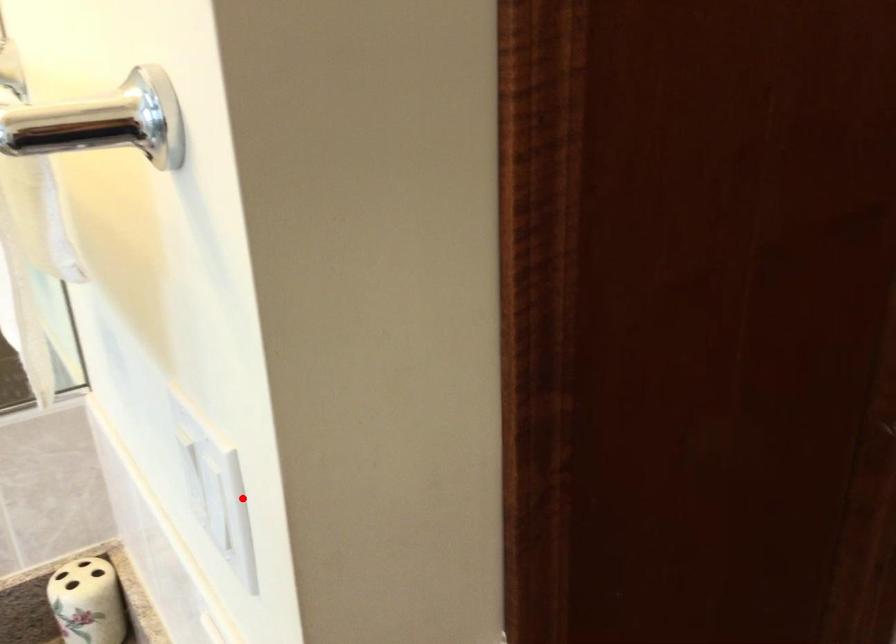
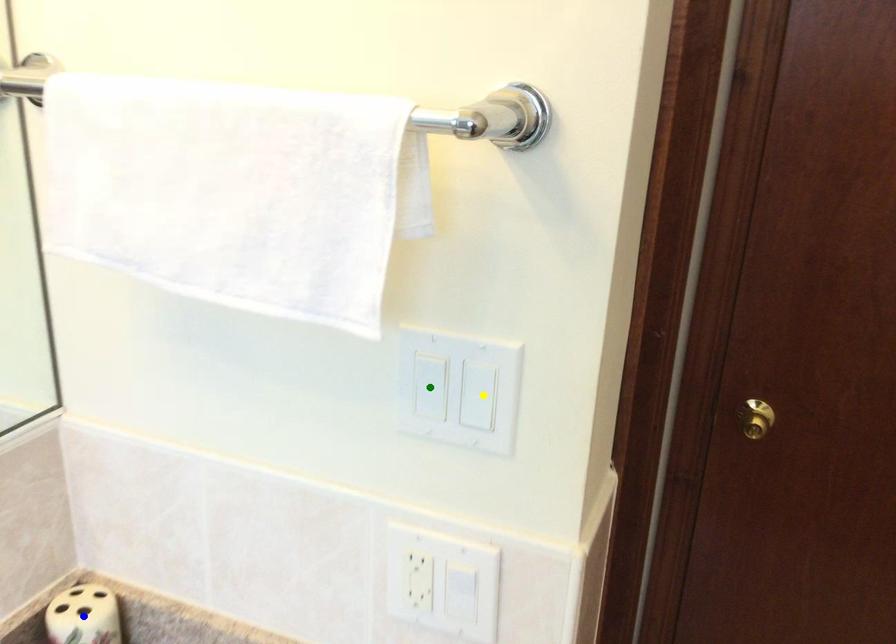
Question: I am providing you with two images of the same scene from different viewpoints. A red point is marked on the first image. You are given multiple points on the second image. Which point in image 2 represents the same 3d spot as the red point in image 1?

Choices:
 (A) green point
 (B) yellow point
 (C) blue point

Answer: (B)